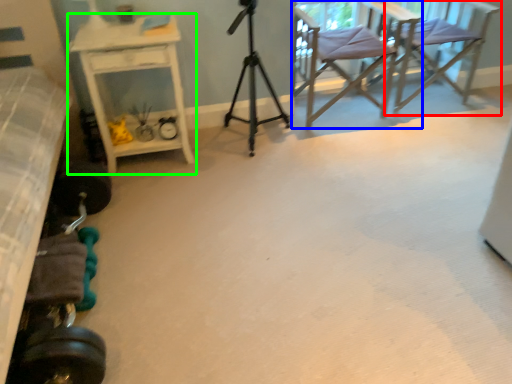
Question: Which object is positioned closest to chair (highlighted by a red box)? Select from chair (highlighted by a blue box) and desk (highlighted by a green box).

Choices:
 (A) chair
 (B) desk

Answer: (A)